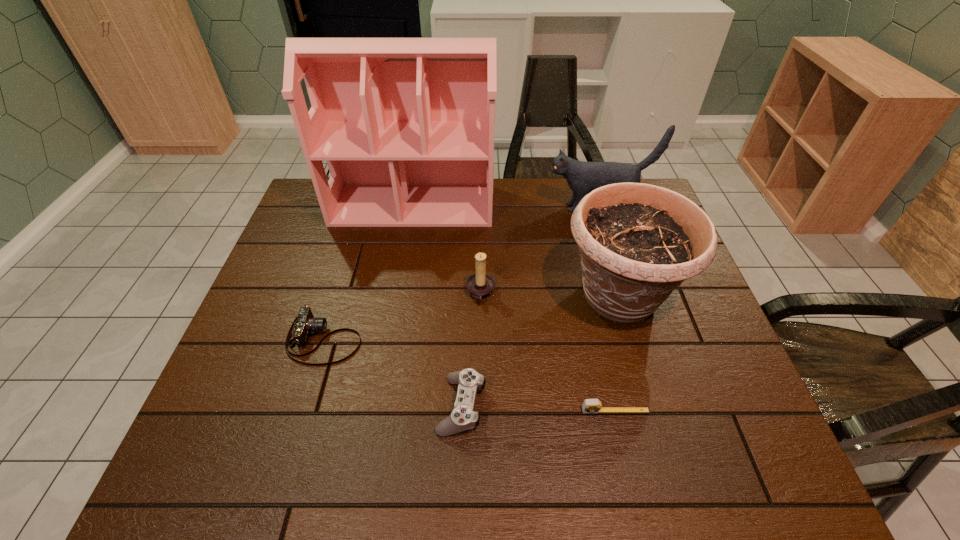
The width and height of the screenshot is (960, 540). What are the coordinates of `vacant region at the right edge of the desktop` in the screenshot? It's located at (663, 320).

Where is `vacant space at the near left corner`? vacant space at the near left corner is located at coordinates (195, 472).

Image resolution: width=960 pixels, height=540 pixels. I want to click on vacant region between the flowerpot and the tape measure, so click(617, 354).

Where is `free area in between the camera and the control`? free area in between the camera and the control is located at coordinates (393, 373).

Where is `free space between the control and the cat`? This screenshot has width=960, height=540. free space between the control and the cat is located at coordinates (529, 306).

You are a GUI agent. You are given a task and a screenshot of the screen. Output one action in this format:
    pyautogui.click(x=<x>, y=<y>)
    Task: Click on the vacant area that lies between the fourth shortest object and the control
    The image size is (960, 540).
    Given the screenshot: What is the action you would take?
    pyautogui.click(x=471, y=349)

You are a GUI agent. You are given a task and a screenshot of the screen. Output one action in this format:
    pyautogui.click(x=<x>, y=<y>)
    Task: Click on the blank region between the fourth shortest object and the dollhouse
    The image size is (960, 540).
    Given the screenshot: What is the action you would take?
    pyautogui.click(x=446, y=249)

Identify the location of free space between the candle holder and the tallest object. This screenshot has height=540, width=960. (446, 249).

Locate an element on the screen. vacant point located between the flowerpot and the tallest object is located at coordinates (516, 251).

The image size is (960, 540). What are the coordinates of `vacant space in between the cat and the control` in the screenshot? It's located at (529, 306).